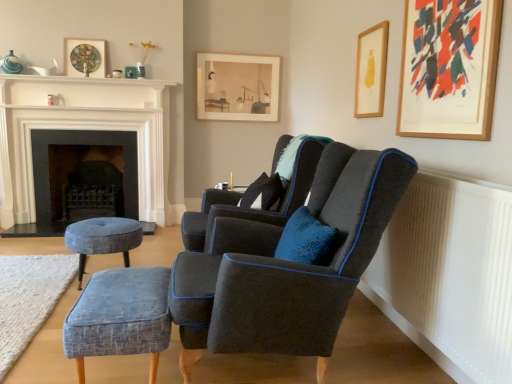
Question: In terms of width, does matte glass picture frame at upper left, acting as the second picture frame starting from the back, look wider or thinner when compared to white glossy fireplace at upper left, the first fireplace positioned from the front?

Choices:
 (A) wide
 (B) thin

Answer: (B)

Question: From a real-world perspective, relative to white glossy fireplace at upper left, the first fireplace positioned from the front, is matte glass picture frame at upper left, the third picture frame when ordered from front to back, vertically above or below?

Choices:
 (A) below
 (B) above

Answer: (B)

Question: Based on their relative distances, which object is nearer to the velvet blue stool at lower left, positioned as the 1th stool in left-to-right order?

Choices:
 (A) dark blue fabric chair at right, the second chair in the back-to-front sequence
 (B) textured blue fabric stool at lower left, positioned as the second stool in left-to-right order
 (C) wooden framed artwork at upper right, marked as the 4th picture frame in a left-to-right arrangement
 (D) velvet dark blue armchair at center, the first chair positioned from the back
 (E) dark gray stone fireplace at left, placed as the 1th fireplace when sorted from back to front

Answer: (D)

Question: Which object is the closest to the textured blue ottoman at lower left?

Choices:
 (A) matte glass picture frame at upper left, the third picture frame when ordered from front to back
 (B) wooden picture frame at upper right, placed as the 3th picture frame when sorted from back to front
 (C) velvet dark blue armchair at center, which is the 2th chair in front-to-back order
 (D) dark blue fabric chair at right, the first chair when ordered from front to back
 (E) dark gray stone fireplace at left, placed as the 1th fireplace when sorted from back to front

Answer: (C)